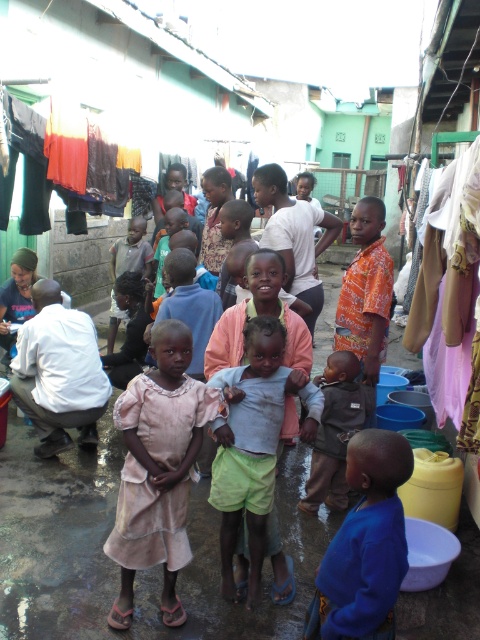
You are a photographer trying to capture a candid shot of the light green shorts at center and the orange printed shirt at center. Since you want both subjects to be clearly visible in the frame, which one should you focus on first to ensure proper focus?

The light green shorts at center is much taller than the orange printed shirt at center, so you should focus on the light green shorts at center first to ensure proper focus.

You are standing in the scene and want to move from point A to point B. Point A is at coordinate point [383,257] and point B is at coordinate point [136,246]. Which point is closer to you, point A or point B?

Point A is closer to you because it is closer to the viewer than point B.

You are standing in the courtyard and want to find the orange printed shirt at center. Which direction should you look relative to the light pink fabric at center?

The orange printed shirt at center is located below the light pink fabric at center, so you should look downward from the light pink fabric at center to find it.